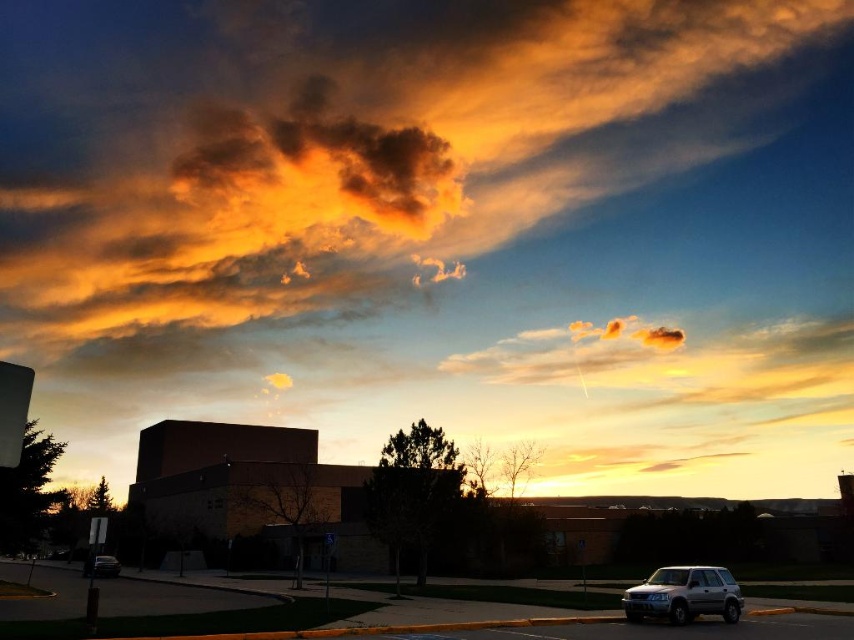
Question: Does silver metallic suv at lower right appear on the right side of satin silver suv at lower left?

Choices:
 (A) no
 (B) yes

Answer: (B)

Question: Which of the following is the closest to the observer?

Choices:
 (A) silver metallic suv at lower right
 (B) golden-orange cotton candy at upper center
 (C) satin silver suv at lower left

Answer: (A)

Question: Which object is closer to the camera taking this photo?

Choices:
 (A) golden-orange cotton candy at upper center
 (B) silver metallic suv at lower right
 (C) satin silver suv at lower left

Answer: (B)

Question: Is golden-orange cotton candy at upper center to the right of silver metallic suv at lower right from the viewer's perspective?

Choices:
 (A) no
 (B) yes

Answer: (A)

Question: Does golden-orange cotton candy at upper center appear under silver metallic suv at lower right?

Choices:
 (A) no
 (B) yes

Answer: (A)

Question: Considering the real-world distances, which object is closest to the satin silver suv at lower left?

Choices:
 (A) golden-orange cotton candy at upper center
 (B) silver metallic suv at lower right

Answer: (B)